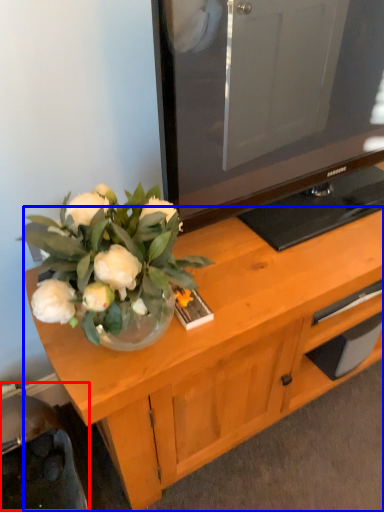
Question: Which point is closer to the camera, swivel chair (highlighted by a red box) or desk (highlighted by a blue box)?

Choices:
 (A) swivel chair
 (B) desk

Answer: (A)